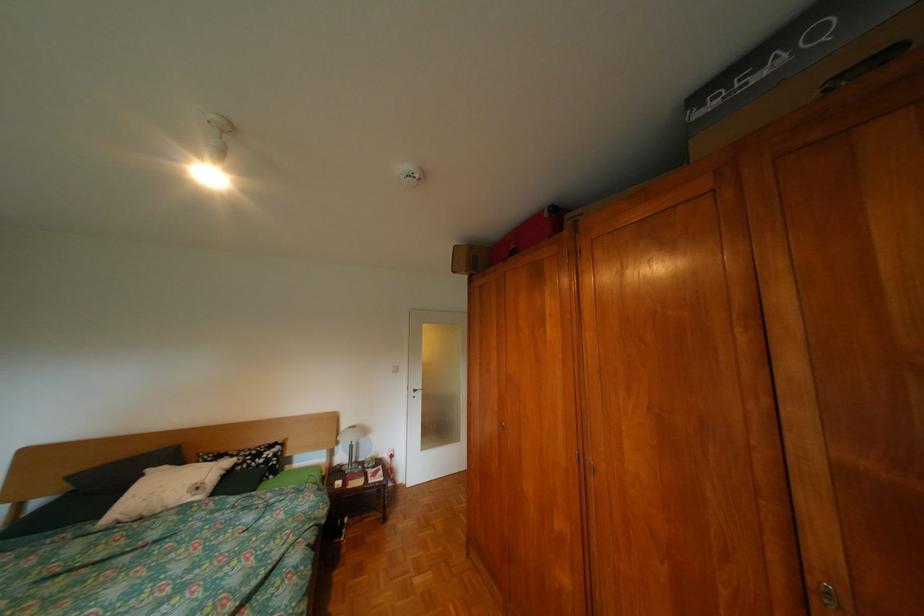
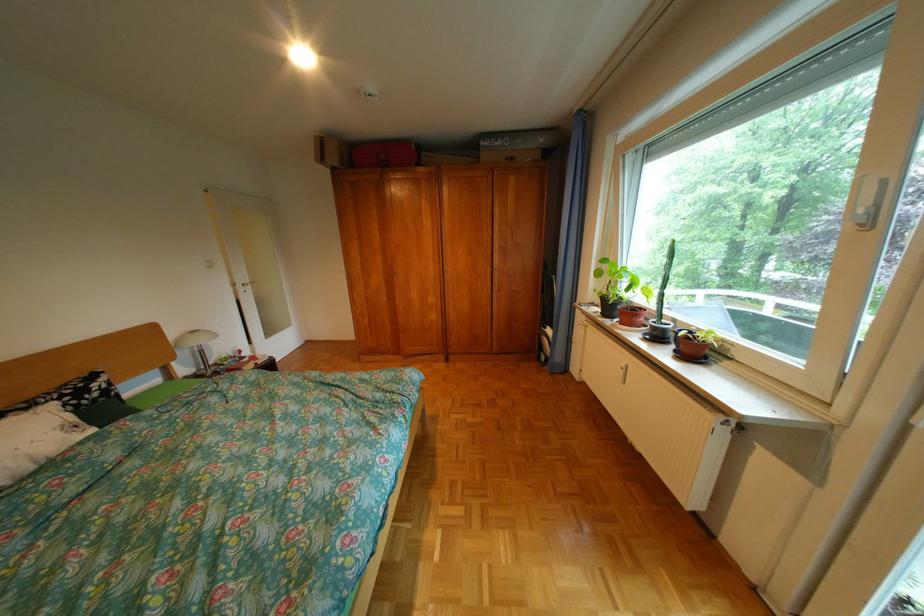
Locate, in the second image, the point that corresponds to point 711,116 in the first image.

(497, 145)